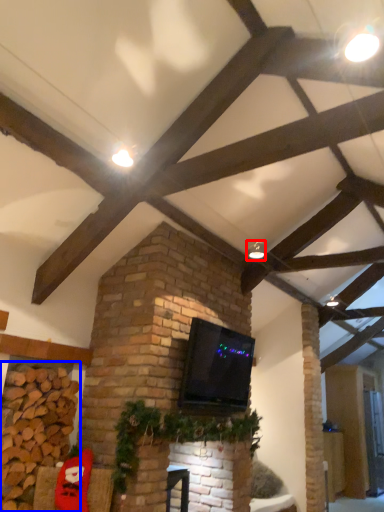
Question: Which object is further to the camera taking this photo, light fixture (highlighted by a red box) or brickwork (highlighted by a blue box)?

Choices:
 (A) light fixture
 (B) brickwork

Answer: (A)